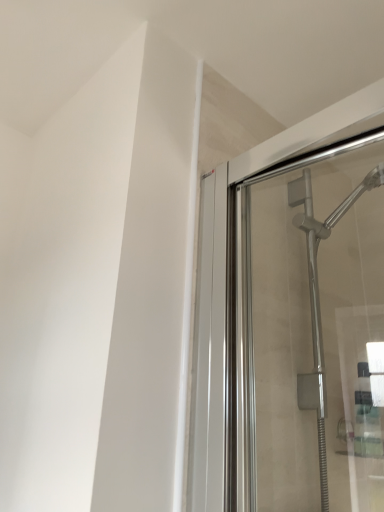
What do you see at coordinates (309, 333) in the screenshot? This screenshot has width=384, height=512. I see `polished chrome shower head at upper right` at bounding box center [309, 333].

Locate an element on the screen. This screenshot has height=512, width=384. polished chrome shower head at upper right is located at coordinates (309, 333).

This screenshot has height=512, width=384. Identify the location of polished chrome shower head at upper right. (309, 333).